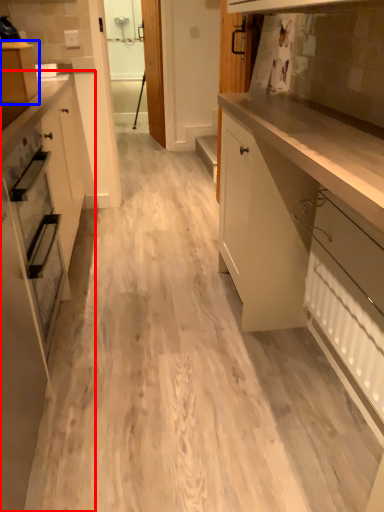
Question: Which of the following is the closest to the observer, cabinetry (highlighted by a red box) or cabinetry (highlighted by a blue box)?

Choices:
 (A) cabinetry
 (B) cabinetry

Answer: (A)